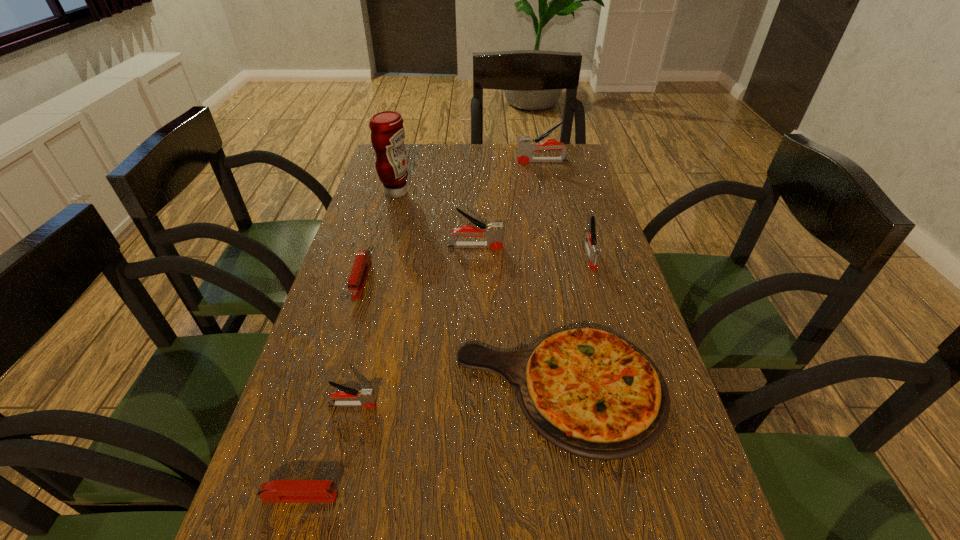
Identify the location of condiment. The width and height of the screenshot is (960, 540). (387, 132).

The width and height of the screenshot is (960, 540). What are the coordinates of `the second farthest object` in the screenshot? It's located at (387, 132).

Where is `the biggest gray stapler`? Image resolution: width=960 pixels, height=540 pixels. the biggest gray stapler is located at coordinates (526, 146).

Where is `the farthest gray stapler`? the farthest gray stapler is located at coordinates point(526,146).

Identify the location of the third stapler from right to left. This screenshot has width=960, height=540. (493, 232).

The image size is (960, 540). In order to click on the fifth shortest stapler in this screenshot , I will do `click(493, 232)`.

At what (x,y) coordinates should I click in order to perform the action: click on the third biggest gray stapler. Please return your answer as a coordinate pair (x, y). This screenshot has height=540, width=960. Looking at the image, I should click on (593, 250).

In order to click on the fourth tallest object in this screenshot , I will do `click(593, 250)`.

The height and width of the screenshot is (540, 960). I want to click on the smallest gray stapler, so click(x=365, y=397).

Where is `the fifth farthest stapler`? This screenshot has height=540, width=960. the fifth farthest stapler is located at coordinates (365, 397).